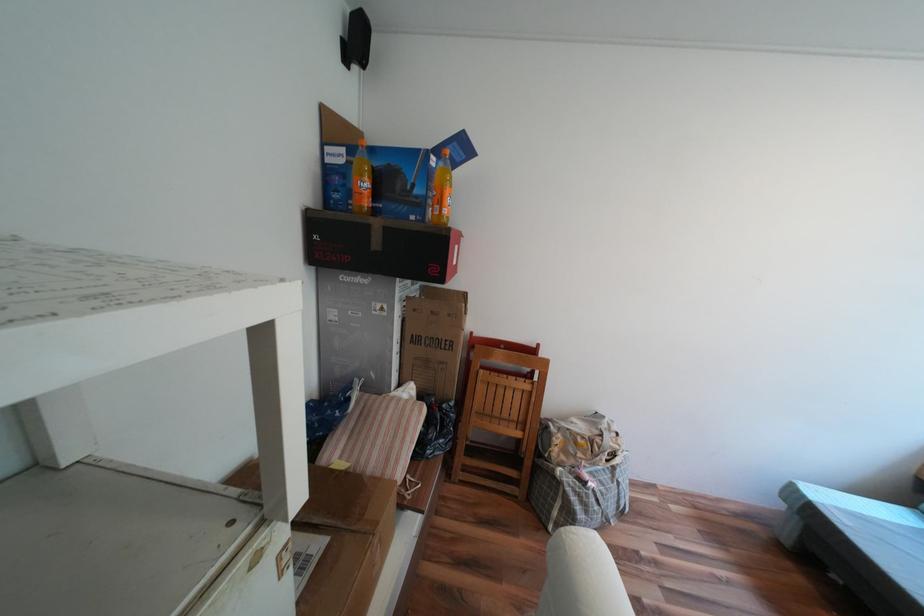
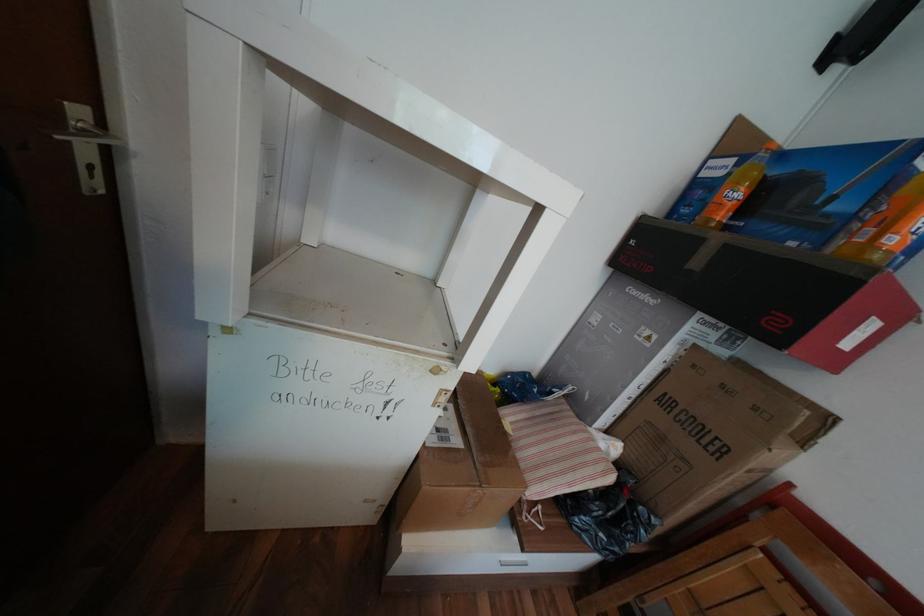
The point at (377, 185) is marked in the first image. Where is the corresponding point in the second image?

(748, 195)